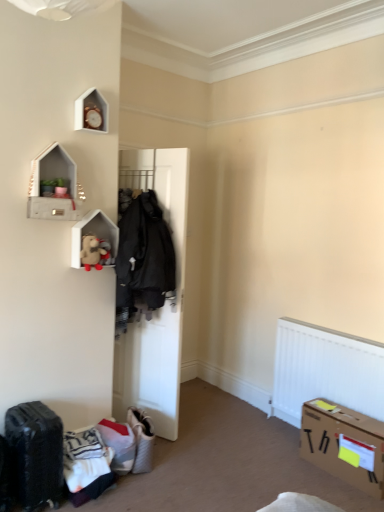
I want to click on vacant area that is in front of white textured fabric suitcase at lower center, the 1th luggage positioned from the back, so click(x=148, y=486).